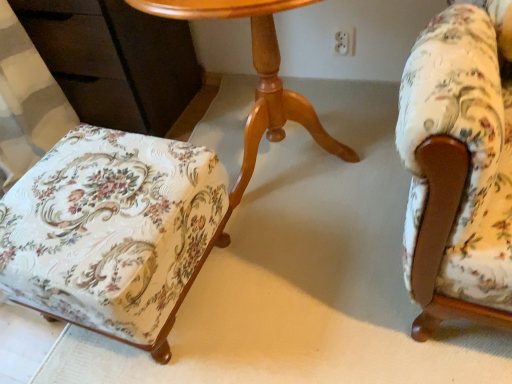
Question: From the image's perspective, is floral fabric armchair at right, acting as the 2th chair starting from the left, on floral fabric ottoman at lower left, the second chair in the right-to-left sequence?

Choices:
 (A) yes
 (B) no

Answer: (A)

Question: Is floral fabric armchair at right, acting as the 2th chair starting from the left, outside floral fabric ottoman at lower left, the second chair in the right-to-left sequence?

Choices:
 (A) no
 (B) yes

Answer: (B)

Question: Is floral fabric ottoman at lower left, the second chair in the right-to-left sequence, inside floral fabric armchair at right, arranged as the first chair when viewed from the right?

Choices:
 (A) yes
 (B) no

Answer: (B)

Question: From the image's perspective, does floral fabric armchair at right, acting as the 2th chair starting from the left, appear lower than floral fabric ottoman at lower left, the second chair in the right-to-left sequence?

Choices:
 (A) yes
 (B) no

Answer: (B)

Question: Considering the relative positions of floral fabric armchair at right, arranged as the first chair when viewed from the right, and floral fabric ottoman at lower left, which is the 1th chair from left to right, in the image provided, is floral fabric armchair at right, arranged as the first chair when viewed from the right, behind floral fabric ottoman at lower left, which is the 1th chair from left to right,?

Choices:
 (A) yes
 (B) no

Answer: (B)

Question: Can you confirm if floral fabric armchair at right, acting as the 2th chair starting from the left, is wider than floral fabric ottoman at lower left, the second chair in the right-to-left sequence?

Choices:
 (A) no
 (B) yes

Answer: (B)

Question: Considering the relative sizes of light brown wood table at center and floral fabric ottoman at lower left, which is the 1th chair from left to right, in the image provided, is light brown wood table at center thinner than floral fabric ottoman at lower left, which is the 1th chair from left to right,?

Choices:
 (A) no
 (B) yes

Answer: (A)

Question: Is light brown wood table at center bigger than floral fabric ottoman at lower left, the second chair in the right-to-left sequence?

Choices:
 (A) no
 (B) yes

Answer: (B)

Question: Can floral fabric ottoman at lower left, which is the 1th chair from left to right, be found inside light brown wood table at center?

Choices:
 (A) yes
 (B) no

Answer: (B)

Question: From a real-world perspective, is light brown wood table at center on top of floral fabric ottoman at lower left, the second chair in the right-to-left sequence?

Choices:
 (A) no
 (B) yes

Answer: (B)

Question: Can you confirm if light brown wood table at center is positioned to the left of floral fabric ottoman at lower left, which is the 1th chair from left to right?

Choices:
 (A) no
 (B) yes

Answer: (A)

Question: From the image's perspective, is light brown wood table at center under floral fabric ottoman at lower left, the second chair in the right-to-left sequence?

Choices:
 (A) yes
 (B) no

Answer: (B)

Question: Can you confirm if floral fabric armchair at right, acting as the 2th chair starting from the left, is shorter than light brown wood table at center?

Choices:
 (A) no
 (B) yes

Answer: (A)